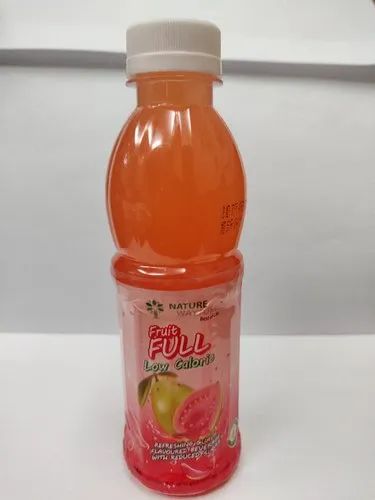
Locate an element on the screen. This screenshot has height=500, width=375. white horizontal surface is located at coordinates (270, 411).